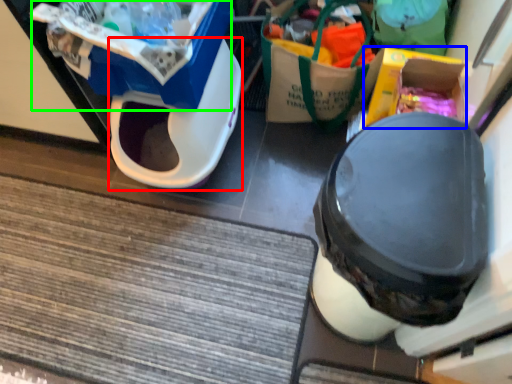
Question: Which is farther away from wide (highlighted by a red box)? storage box (highlighted by a blue box) or storage box (highlighted by a green box)?

Choices:
 (A) storage box
 (B) storage box

Answer: (A)